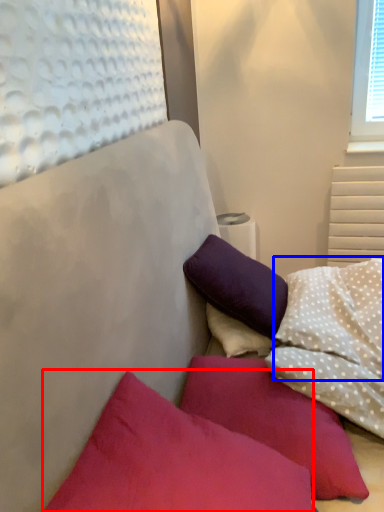
Question: Which point is further to the camera, pillow (highlighted by a red box) or pillow (highlighted by a blue box)?

Choices:
 (A) pillow
 (B) pillow

Answer: (B)